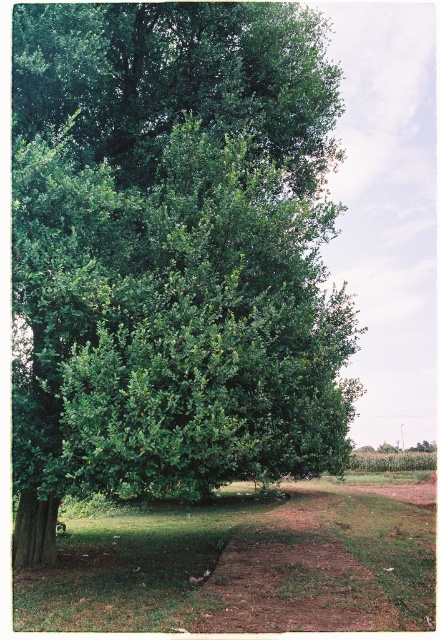
Based on the photo, you are a gardener planning to water both the green leafy tree at center and the green leafy tree at upper center. Which tree requires more water if the thinner tree needs more water?

The green leafy tree at center requires more water because it is thinner than the green leafy tree at upper center, and thinner trees typically need more water.

You are standing at point A, which is at coordinates [173,253]. Looking around, you see a green leafy tree at center. Can you determine if you are standing under the tree?

Yes, you are standing under the green leafy tree at center because the point [173,253] is where the tree is located.

You are standing in front of the tree and notice two points marked on the image. The first point is at coordinate point (22, 500) and the second is at point (414, 522). Which of these two points is closer to you?

Point (22, 500) is closer to the viewer than point (414, 522).